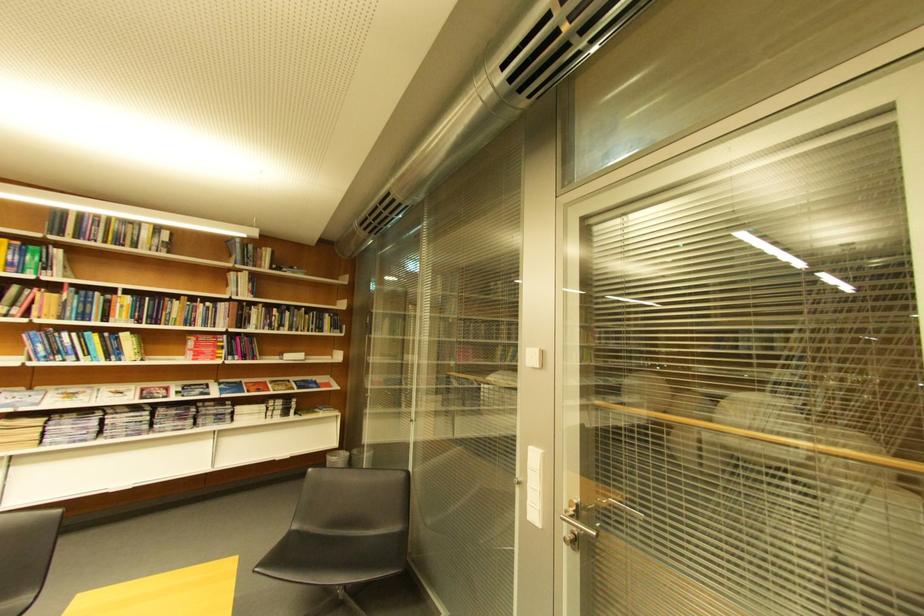
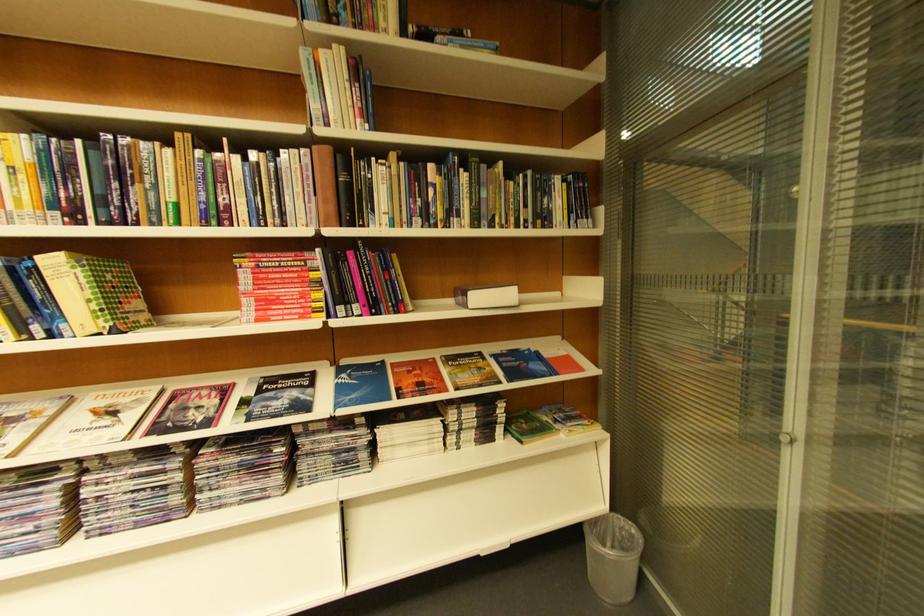
Locate, in the second image, the point that corresponds to (136,337) in the first image.

(63, 264)